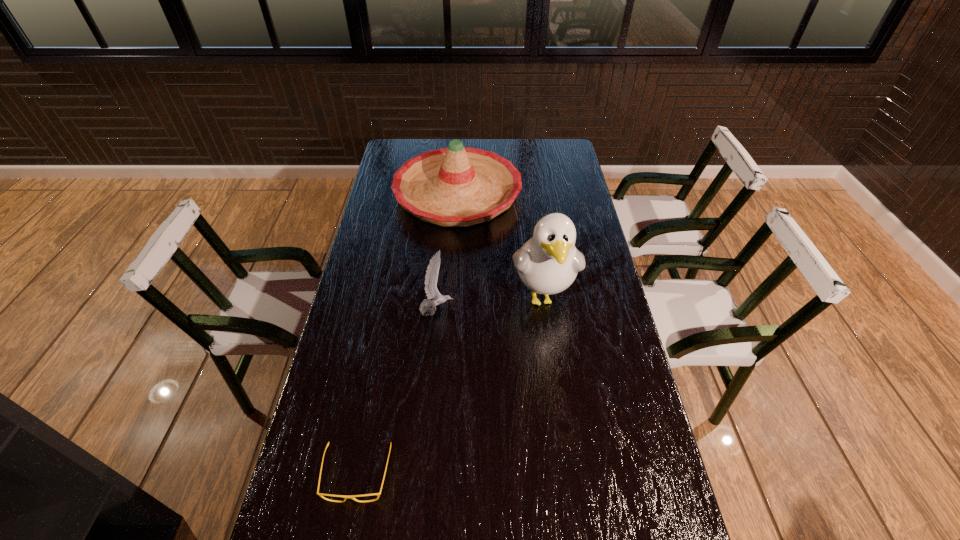
Identify the location of the third closest object to the shorter gull. (320, 494).

In order to click on object identified as the closest to the shorter gull in this screenshot , I will do `click(548, 263)`.

At what (x,y) coordinates should I click in order to perform the action: click on vacant space that satisfies the following two spatial constraints: 1. at the tip of the beak of the left gull; 2. in front of the lenses of the nearest object. Please return your answer as a coordinate pair (x, y). This screenshot has width=960, height=540. Looking at the image, I should click on (422, 474).

Where is `free space that satisfies the following two spatial constraints: 1. at the tip of the beak of the second shortest object; 2. in front of the lenses of the spectacles`? free space that satisfies the following two spatial constraints: 1. at the tip of the beak of the second shortest object; 2. in front of the lenses of the spectacles is located at coordinates (422, 474).

At what (x,y) coordinates should I click in order to perform the action: click on vacant area that satisfies the following two spatial constraints: 1. on the beak of the taller gull; 2. at the tip of the beak of the left gull. Please return your answer as a coordinate pair (x, y). Looking at the image, I should click on (544, 310).

Find the location of a particular element. This screenshot has width=960, height=540. free spot that satisfies the following two spatial constraints: 1. at the tip of the beak of the third tallest object; 2. in front of the lenses of the shortest object is located at coordinates (422, 474).

The image size is (960, 540). I want to click on free point that satisfies the following two spatial constraints: 1. on the front side of the sombrero; 2. at the tip of the beak of the left gull, so click(450, 310).

This screenshot has width=960, height=540. Find the location of `vacant region that satisfies the following two spatial constraints: 1. on the front side of the third shortest object; 2. at the tip of the beak of the second shortest object`. vacant region that satisfies the following two spatial constraints: 1. on the front side of the third shortest object; 2. at the tip of the beak of the second shortest object is located at coordinates (450, 310).